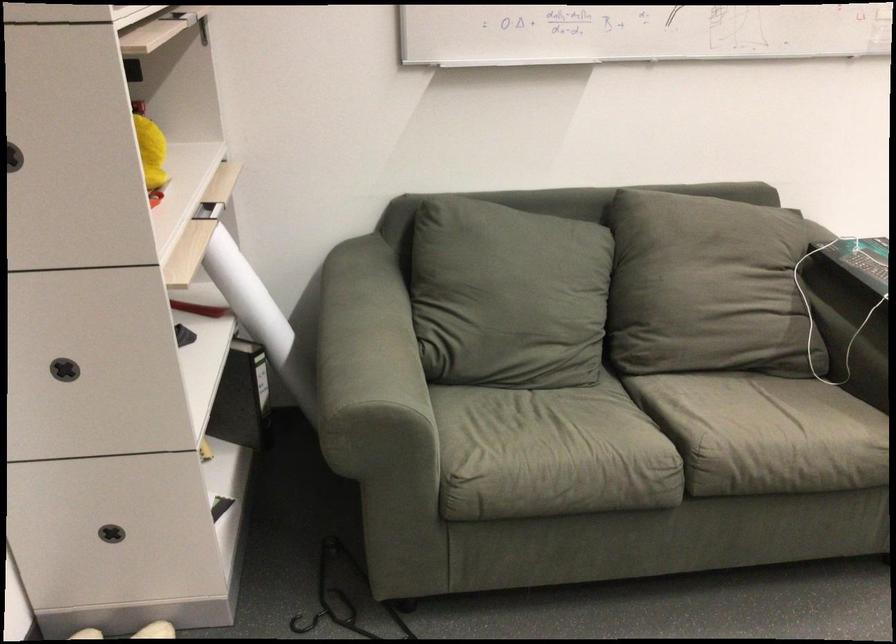
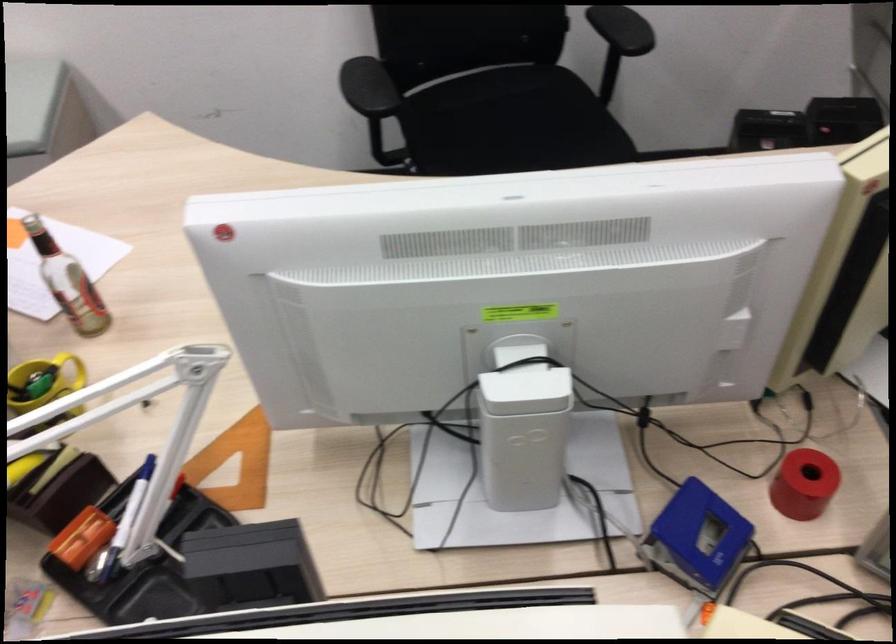
Question: Which direction would the cameraman need to move to produce the second image? Reply with the corresponding letter.

Choices:
 (A) Left
 (B) Right
 (C) Forward
 (D) Backward

Answer: (B)